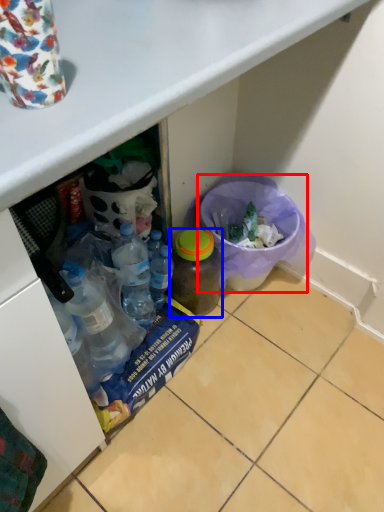
Question: Among these objects, which one is nearest to the camera, recycling bin (highlighted by a red box) or bottle (highlighted by a blue box)?

Choices:
 (A) recycling bin
 (B) bottle

Answer: (B)